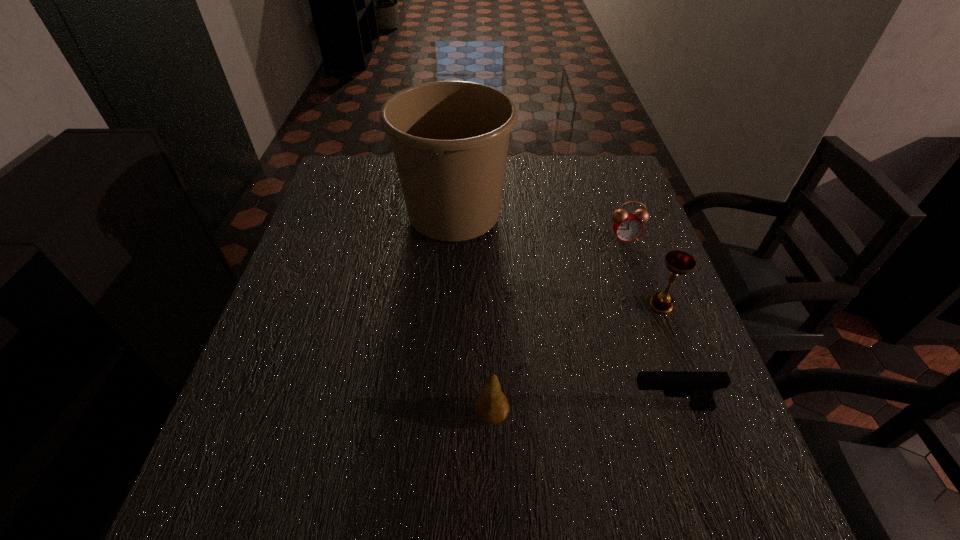
Find the location of a particular element. unoccupied position between the pistol and the pear is located at coordinates (581, 410).

The width and height of the screenshot is (960, 540). In order to click on vacant area that lies between the pear and the bucket in this screenshot , I will do `click(473, 313)`.

Find the location of a particular element. Image resolution: width=960 pixels, height=540 pixels. object that stands as the second closest to the bucket is located at coordinates (678, 262).

Identify which object is located as the third nearest to the alarm clock. Please provide its 2D coordinates. Your answer should be formatted as a tuple, i.e. [(x, y)], where the tuple contains the x and y coordinates of a point satisfying the conditions above.

[(700, 386)]

Where is `free space that satisfies the following two spatial constraints: 1. on the front side of the pear; 2. on the left side of the bucket`? This screenshot has width=960, height=540. free space that satisfies the following two spatial constraints: 1. on the front side of the pear; 2. on the left side of the bucket is located at coordinates (441, 414).

Image resolution: width=960 pixels, height=540 pixels. In order to click on free point that satisfies the following two spatial constraints: 1. on the front-facing side of the pistol; 2. on the front side of the pear in this screenshot , I will do `click(672, 414)`.

Find the location of a particular element. free space that satisfies the following two spatial constraints: 1. on the front side of the second tallest object; 2. on the front-facing side of the pistol is located at coordinates (698, 406).

This screenshot has width=960, height=540. Find the location of `free spot that satisfies the following two spatial constraints: 1. on the clock face of the alarm clock; 2. on the front-facing side of the pistol`. free spot that satisfies the following two spatial constraints: 1. on the clock face of the alarm clock; 2. on the front-facing side of the pistol is located at coordinates (683, 406).

Where is `vacant point that satisfies the following two spatial constraints: 1. on the clock face of the chalice; 2. on the left side of the alarm clock`? vacant point that satisfies the following two spatial constraints: 1. on the clock face of the chalice; 2. on the left side of the alarm clock is located at coordinates (648, 306).